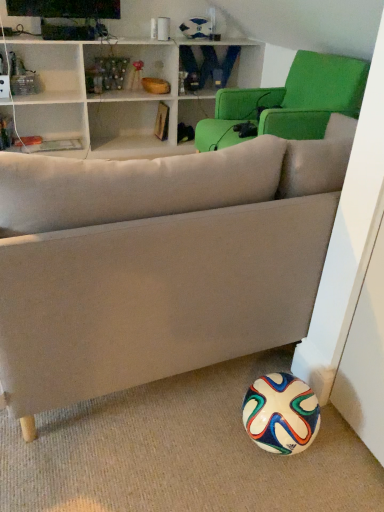
This screenshot has height=512, width=384. Describe the element at coordinates (159, 262) in the screenshot. I see `beige fabric couch at lower center` at that location.

In the scene shown: What is the approximate height of beige fabric couch at lower center?

The height of beige fabric couch at lower center is 2.35 inches.

What are the coordinates of `beige fabric couch at lower center` in the screenshot? It's located at (159, 262).

Locate an element on the screen. This screenshot has width=384, height=512. beige fabric couch at lower center is located at coordinates (159, 262).